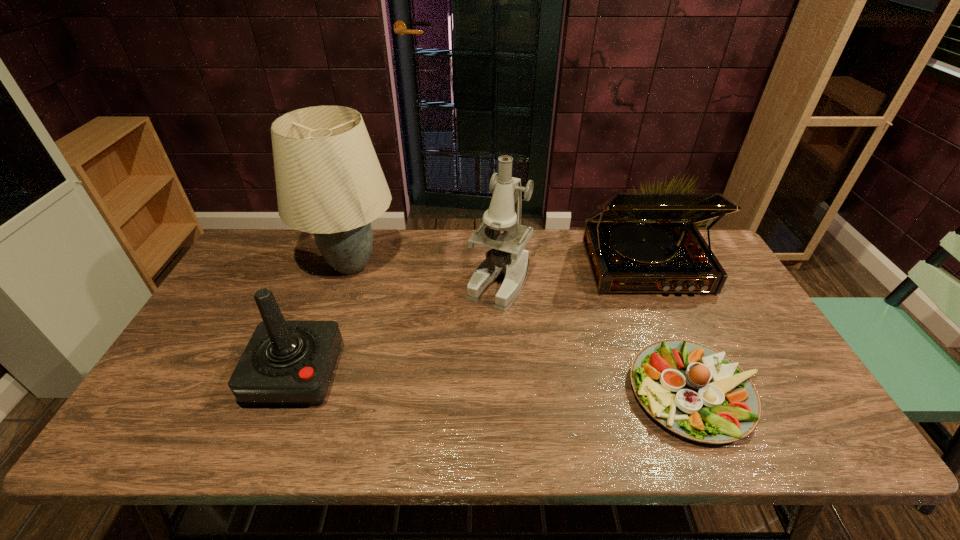
This screenshot has height=540, width=960. I want to click on free space that is in between the lampshade and the salad plate, so click(523, 329).

Where is `vacant area that lies between the microscope and the shortest object`? vacant area that lies between the microscope and the shortest object is located at coordinates (597, 337).

This screenshot has width=960, height=540. Identify the location of free space between the lampshade and the salad plate. (523, 329).

Identify the location of free space between the record player and the joystick. (470, 320).

Find the location of `the second closest object to the joystick`. the second closest object to the joystick is located at coordinates (507, 258).

Locate an element on the screen. object identified as the closest to the record player is located at coordinates (695, 391).

At what (x,y) coordinates should I click in order to perform the action: click on free point that satisfies the following two spatial constraints: 1. on the front-facing side of the salad plate; 2. on the right side of the joystick. Please return your answer as a coordinate pair (x, y). This screenshot has height=540, width=960. Looking at the image, I should click on (289, 393).

Where is `vacant space that satisfies the following two spatial constraints: 1. on the front side of the lampshade; 2. on the left side of the fourth shortest object`? This screenshot has width=960, height=540. vacant space that satisfies the following two spatial constraints: 1. on the front side of the lampshade; 2. on the left side of the fourth shortest object is located at coordinates (346, 281).

At what (x,y) coordinates should I click in order to perform the action: click on free space that satisfies the following two spatial constraints: 1. on the front side of the shortest object; 2. on the right side of the second tallest object. Please return your answer as a coordinate pair (x, y). Image resolution: width=960 pixels, height=540 pixels. Looking at the image, I should click on (504, 393).